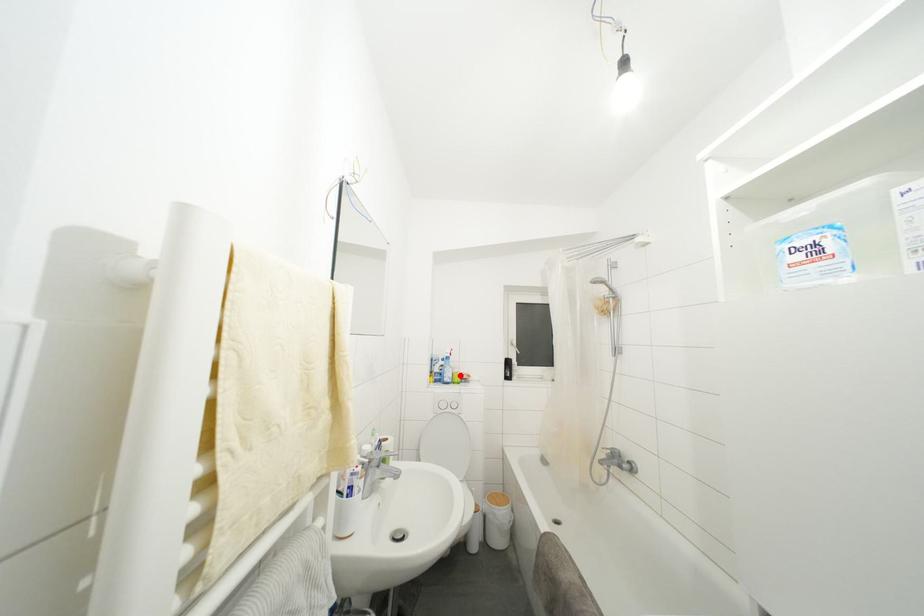
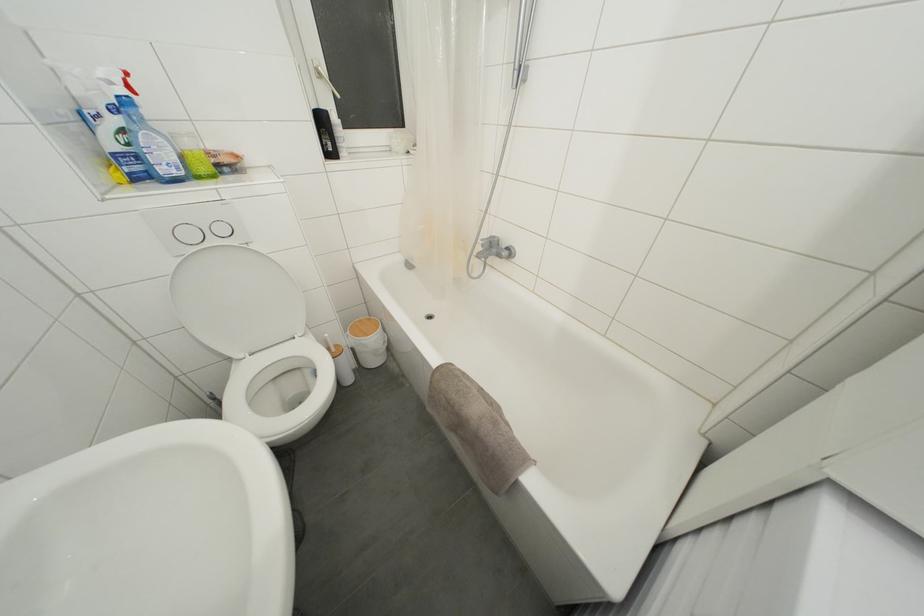
In the second image, find the point that corresponds to the highlighted location in the first image.

(193, 148)